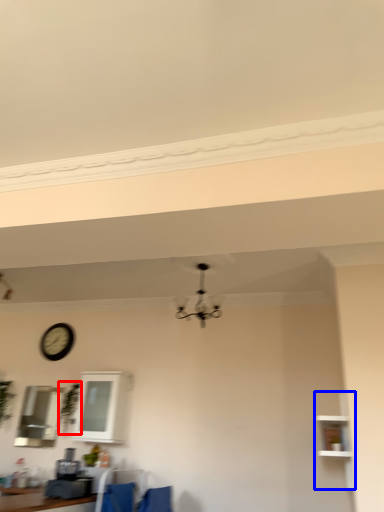
Question: Among these objects, which one is nearest to the camera, plant (highlighted by a red box) or shelf (highlighted by a blue box)?

Choices:
 (A) plant
 (B) shelf

Answer: (B)